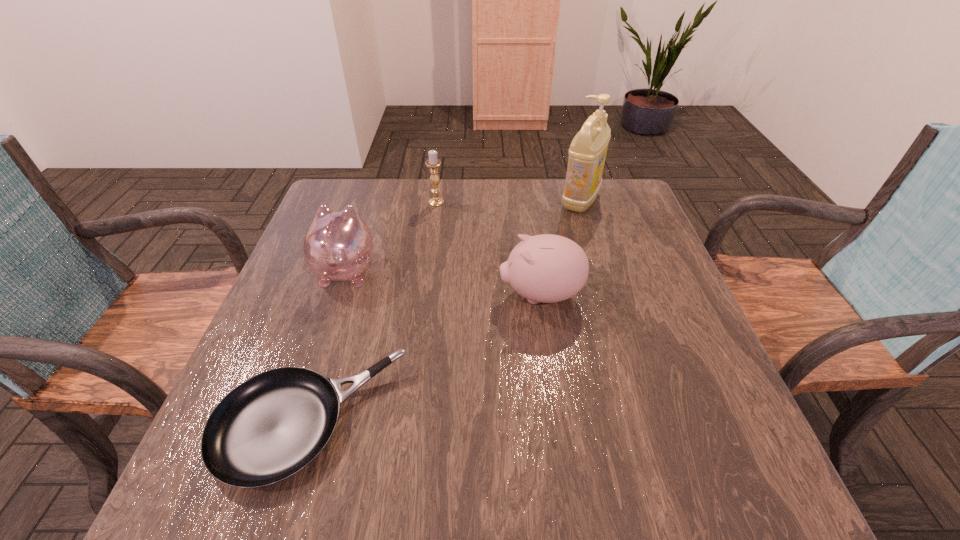
Locate an element on the screen. vacant space located on the front facing side of the left piggy bank is located at coordinates (357, 234).

Image resolution: width=960 pixels, height=540 pixels. Find the location of `vacant space located at the snout of the right piggy bank`. vacant space located at the snout of the right piggy bank is located at coordinates (371, 295).

Find the location of a particular element. This screenshot has width=960, height=540. vacant space situated at the snout of the right piggy bank is located at coordinates (367, 295).

Where is `free space located 0.130m at the snout of the right piggy bank`? free space located 0.130m at the snout of the right piggy bank is located at coordinates (442, 295).

Locate an element on the screen. free region located 0.260m on the right of the pan is located at coordinates (549, 422).

Find the location of a particular element. detergent that is at the far edge is located at coordinates (587, 153).

Find the location of a particular element. The width and height of the screenshot is (960, 540). candle holder positioned at the far edge is located at coordinates (433, 163).

In order to click on object located at the near edge in this screenshot , I will do `click(268, 428)`.

In order to click on piggy bank at the left edge in this screenshot , I will do `click(338, 246)`.

The image size is (960, 540). I want to click on pan located at the left edge, so click(x=268, y=428).